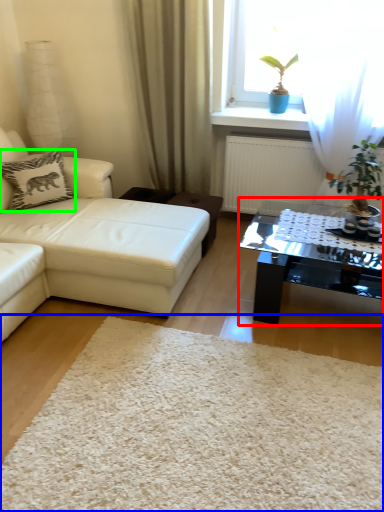
Question: Which object is the farthest from coffee table (highlighted by a red box)? Choose among these: plain (highlighted by a blue box) or pillow (highlighted by a green box).

Choices:
 (A) plain
 (B) pillow

Answer: (B)